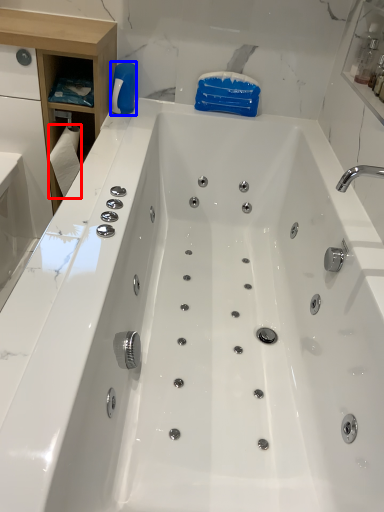
Question: Which point is further to the camera, toilet paper (highlighted by a red box) or cleaning product (highlighted by a blue box)?

Choices:
 (A) toilet paper
 (B) cleaning product

Answer: (B)